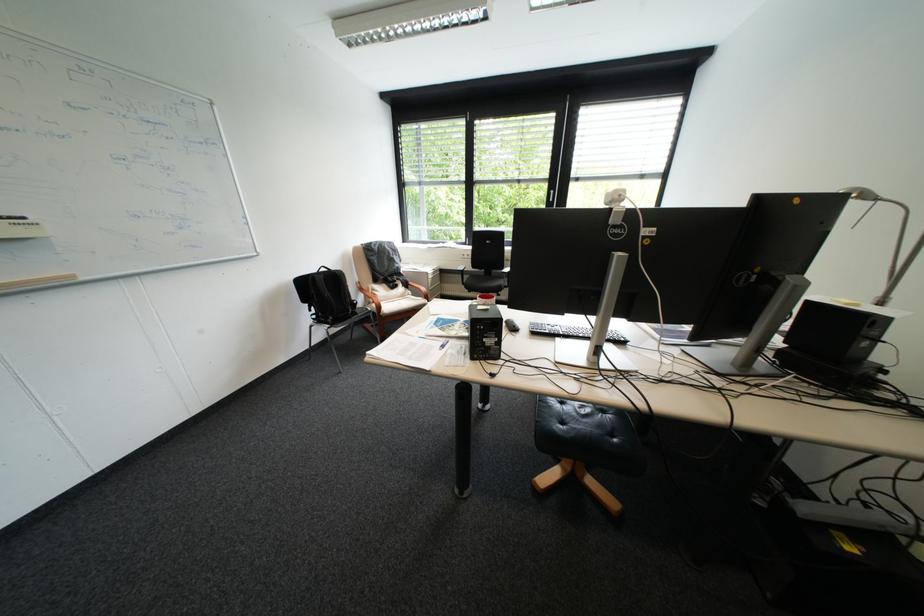
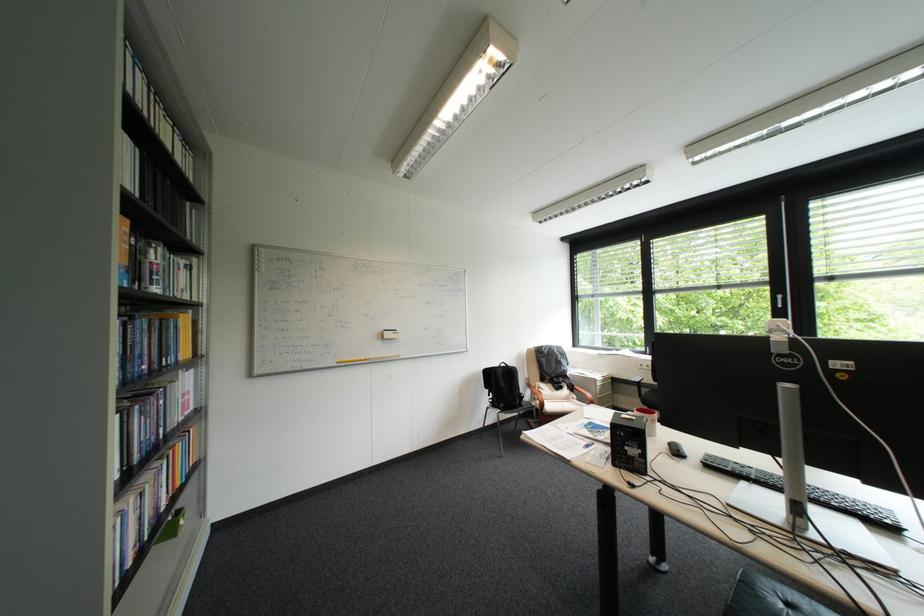
Locate, in the second image, the point that corresponds to (x=440, y=273) in the first image.

(608, 379)